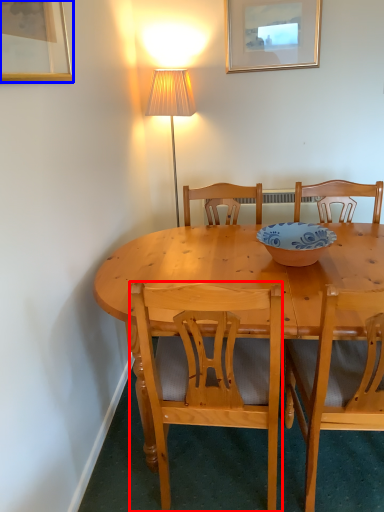
Question: Which object is further to the camera taking this photo, chair (highlighted by a red box) or picture frame (highlighted by a blue box)?

Choices:
 (A) chair
 (B) picture frame

Answer: (A)